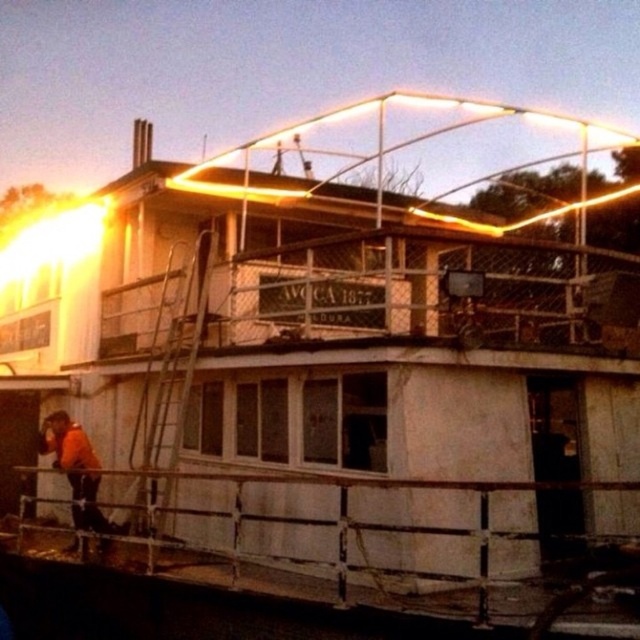
Can you confirm if metallic silver ladder at left is smaller than orange fabric construction worker at lower left?

Actually, metallic silver ladder at left might be larger than orange fabric construction worker at lower left.

Which is above, metallic silver ladder at left or orange fabric construction worker at lower left?

metallic silver ladder at left is above.

I want to click on metallic silver ladder at left, so click(x=168, y=392).